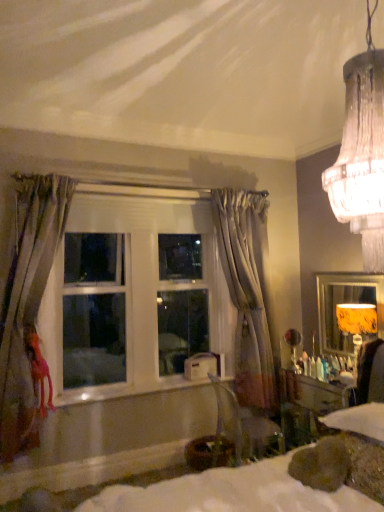
Question: Is orange fabric lampshade at right bigger or smaller than yellow fabric lampshade at right?

Choices:
 (A) small
 (B) big

Answer: (B)

Question: From a real-world perspective, is orange fabric lampshade at right above or below yellow fabric lampshade at right?

Choices:
 (A) below
 (B) above

Answer: (A)

Question: Estimate the real-world distances between objects in this image. Which object is farther from the white glossy window at center?

Choices:
 (A) orange fabric lampshade at right
 (B) velvet gray armchair at lower right
 (C) yellow fabric lampshade at right
 (D) white glossy window sill at center
 (E) silky gray curtain at left, acting as the first curtain starting from the front

Answer: (A)

Question: Considering the real-world distances, which object is closest to the velvet gray armchair at lower right?

Choices:
 (A) yellow fabric lampshade at right
 (B) white glossy window sill at center
 (C) orange fabric lampshade at right
 (D) white glossy window at center
 (E) white fabric bed at lower center

Answer: (B)